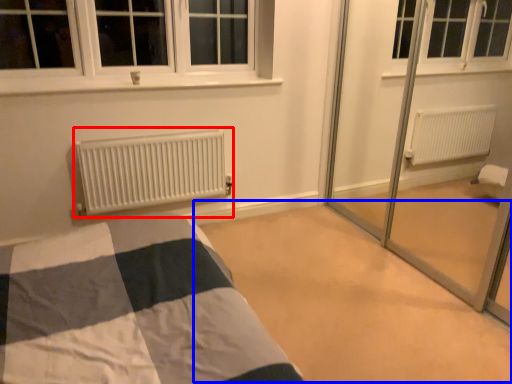
Question: Among these objects, which one is nearest to the camera, heater (highlighted by a red box) or plain (highlighted by a blue box)?

Choices:
 (A) heater
 (B) plain

Answer: (B)